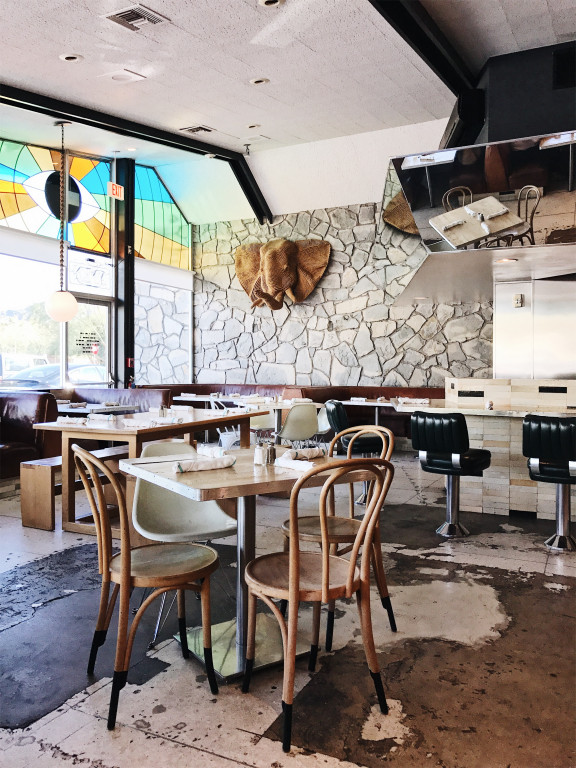
At what (x,y) coordinates should I click in order to perform the action: click on 7 chairs. Please return your answer as a coordinate pair (x, y). The width and height of the screenshot is (576, 768). Looking at the image, I should click on (293, 419).